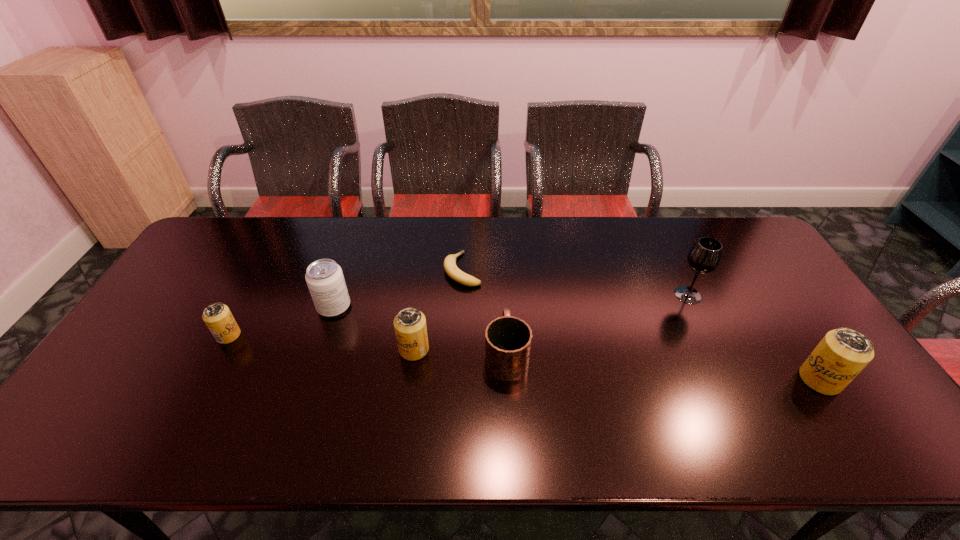
I want to click on free point located on the side of the mug with the handle, so click(x=501, y=258).

Image resolution: width=960 pixels, height=540 pixels. Find the location of `object at the far edge`. object at the far edge is located at coordinates (452, 270).

Where is `object at the near edge`? Image resolution: width=960 pixels, height=540 pixels. object at the near edge is located at coordinates (843, 353).

Locate an element on the screen. object at the right edge is located at coordinates (843, 353).

Locate an element on the screen. The image size is (960, 540). object that is at the near right corner is located at coordinates (843, 353).

At what (x,y) coordinates should I click in order to perform the action: click on vacant space at the far edge of the desktop. Please return your answer as a coordinate pair (x, y). This screenshot has width=960, height=540. Looking at the image, I should click on (658, 234).

You are a GUI agent. You are given a task and a screenshot of the screen. Output one action in this format:
    pyautogui.click(x=<x>, y=<y>)
    Task: Click on the vacant space at the near edge of the desktop
    This screenshot has height=540, width=960.
    Given the screenshot: What is the action you would take?
    pyautogui.click(x=450, y=409)

I want to click on free region at the left edge, so click(x=175, y=310).

Find the location of a particular element. Image resolution: width=960 pixels, height=540 pixels. vacant position at the right edge of the desktop is located at coordinates (789, 320).

This screenshot has width=960, height=540. In the image, there is a desktop. In order to click on free space at the near left corner in this screenshot , I will do `click(106, 392)`.